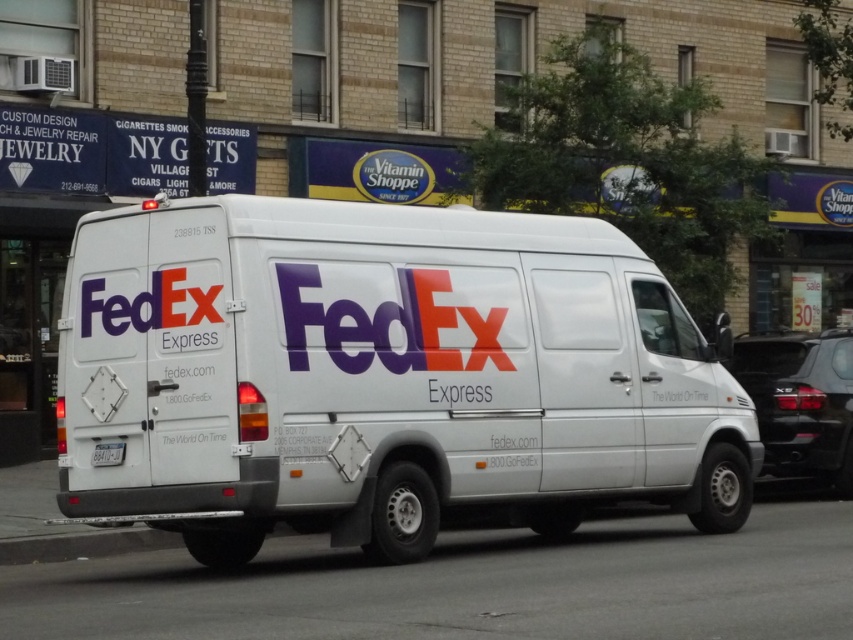
You are a delivery driver who needs to check the license plate of the white matte fedex van at center. From your current position in front of the van, which direction should you walk to reach the white plastic license plate at rear?

The white matte fedex van at center is to the right of the white plastic license plate at rear, so you should walk to the left to reach the white plastic license plate at rear.

You are a traffic officer observing two vehicles on the street. You see the white matte fedex van at center and the black glossy suv at right. Which vehicle would require a larger parking space to accommodate its size?

The black glossy suv at right requires a larger parking space because it is bigger than the white matte fedex van at center.